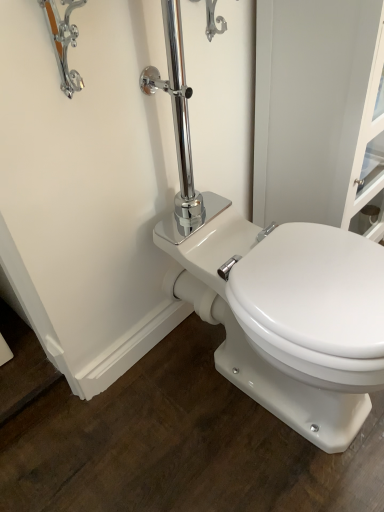
The image size is (384, 512). What are the coordinates of `free spot above white glossy porcelain toilet at center (from a real-world perspective)` in the screenshot? It's located at (319, 273).